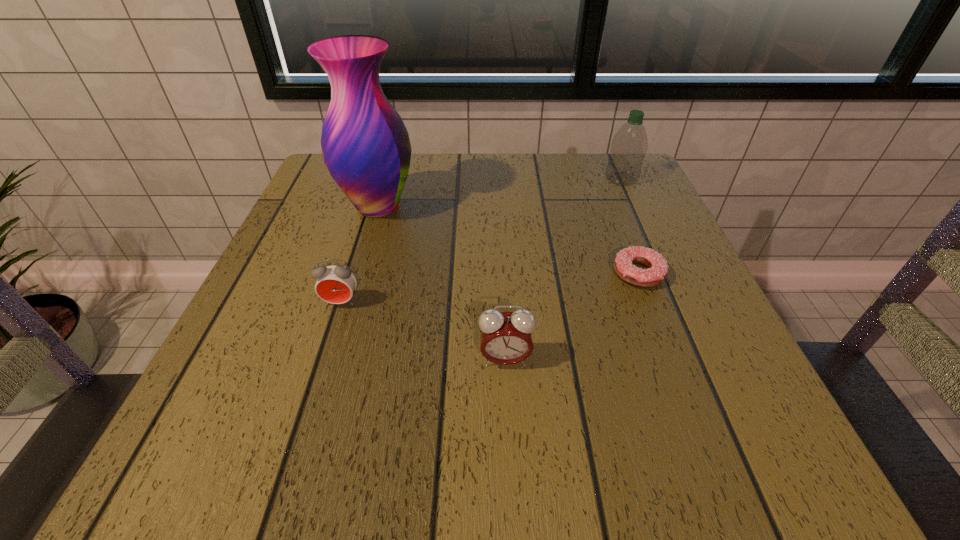
This screenshot has width=960, height=540. Identify the location of object situated at the far right corner. (629, 146).

Where is `free region at the far edge of the desktop`? Image resolution: width=960 pixels, height=540 pixels. free region at the far edge of the desktop is located at coordinates (482, 157).

In the image, there is a desktop. At what (x,y) coordinates should I click in order to perform the action: click on vacant space at the near edge. Please return your answer as a coordinate pair (x, y). This screenshot has height=540, width=960. Looking at the image, I should click on (459, 430).

Image resolution: width=960 pixels, height=540 pixels. I want to click on free space at the left edge, so click(294, 303).

In the image, there is a desktop. Where is `vacant space at the right edge`? The image size is (960, 540). vacant space at the right edge is located at coordinates (656, 350).

The height and width of the screenshot is (540, 960). I want to click on vacant area at the far left corner, so click(x=312, y=181).

Locate an element on the screen. The image size is (960, 540). empty location between the third farthest object and the tallest object is located at coordinates [508, 240].

Identify the location of vacant point located between the water bottle and the third farthest object. pos(630,226).

Where is `free spot between the farther alarm clock and the nearest object`? free spot between the farther alarm clock and the nearest object is located at coordinates (423, 330).

This screenshot has height=540, width=960. In order to click on free space between the nearest object and the fourth shortest object in this screenshot , I will do `click(564, 269)`.